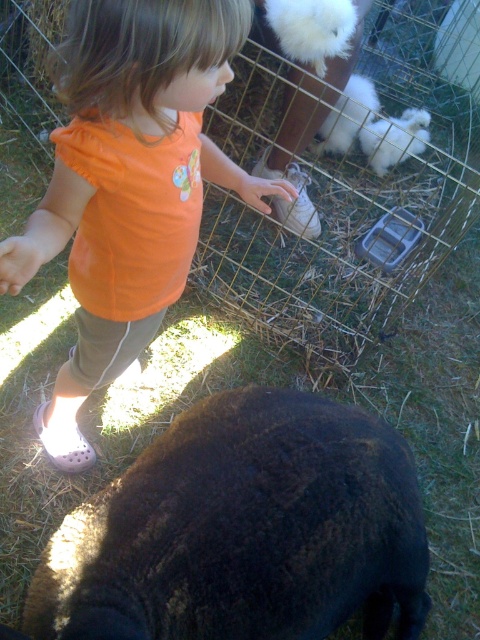
You are a photographer trying to capture a photo of the black woolen sheep at lower left and the orange cotton shirt at center. If you want both subjects to be fully visible in the frame, which one should you position closer to the camera?

The black woolen sheep at lower left might be wider than orange cotton shirt at center, so you should position the black woolen sheep at lower left closer to the camera to ensure both are fully visible.

You are a parent trying to ensure your child stays safe while observing the animals. The black woolen sheep at lower left and orange cotton shirt at center are in the scene. Which object is positioned lower in the image?

The black woolen sheep at lower left is below the orange cotton shirt at center, so the sheep is positioned lower in the image.

You are a parent trying to ensure your child stays safe while interacting with the animals. The black woolen sheep at lower left and the orange cotton shirt at center are 21.63 inches apart. Can you determine if the distance between them is within the recommended safety zone of 24 inches for children near livestock?

The distance between the black woolen sheep at lower left and the orange cotton shirt at center is 21.63 inches, which is within the recommended safety zone of 24 inches for children near livestock.